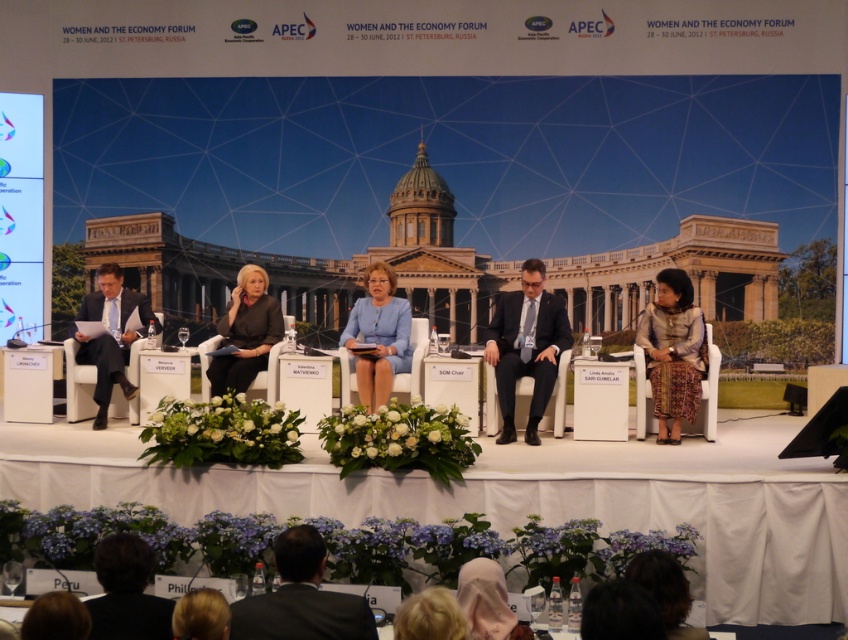
Who is taller, silk skirt at right or dark suit at left?

Standing taller between the two is silk skirt at right.

Does silk skirt at right have a greater width compared to dark suit at left?

In fact, silk skirt at right might be narrower than dark suit at left.

The width and height of the screenshot is (848, 640). Describe the element at coordinates (672, 352) in the screenshot. I see `silk skirt at right` at that location.

I want to click on silk skirt at right, so click(x=672, y=352).

How far apart are blue fabric dress at center and dark suit at left?

They are 14.88 meters apart.

Is blue fabric dress at center above dark suit at left?

Correct, blue fabric dress at center is located above dark suit at left.

Between point (378, 285) and point (82, 317), which one is positioned in front?

Point (378, 285)

At what (x,y) coordinates should I click in order to perform the action: click on blue fabric dress at center. Please return your answer as a coordinate pair (x, y). This screenshot has height=640, width=848. Looking at the image, I should click on (378, 336).

Is silk skirt at right smaller than dark gray suit at center?

Incorrect, silk skirt at right is not smaller in size than dark gray suit at center.

Is silk skirt at right thinner than dark gray suit at center?

Yes, silk skirt at right is thinner than dark gray suit at center.

The height and width of the screenshot is (640, 848). What do you see at coordinates (672, 352) in the screenshot?
I see `silk skirt at right` at bounding box center [672, 352].

The height and width of the screenshot is (640, 848). I want to click on silk skirt at right, so click(x=672, y=352).